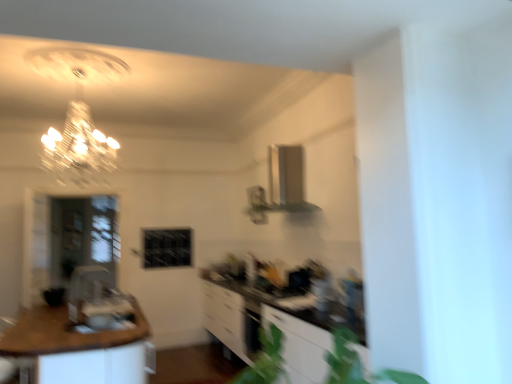
What do you see at coordinates (265, 327) in the screenshot? I see `white glossy cabinetry at center` at bounding box center [265, 327].

In order to face brown wood countertop at lower left, should I rotate leftwards or rightwards?

You should rotate left by 22.401 degrees.

Identify the location of white glossy cabinetry at center. The height and width of the screenshot is (384, 512). (265, 327).

Is brown wood countertop at lower left far away from transparent glass door at left?

Yes, brown wood countertop at lower left is far from transparent glass door at left.

Is brown wood countertop at lower left to the left or to the right of transparent glass door at left in the image?

brown wood countertop at lower left is to the right of transparent glass door at left.

How different are the orientations of brown wood countertop at lower left and transparent glass door at left in degrees?

There is a 91-degree angle between the facing directions of brown wood countertop at lower left and transparent glass door at left.

Is brown wood countertop at lower left surrounding transparent glass door at left?

No.

This screenshot has width=512, height=384. I want to click on cabinetry below the brown wood countertop at lower left (from a real-world perspective), so click(x=265, y=327).

Which of these two, brown wood countertop at lower left or white glossy cabinetry at center, is wider?

Wider between the two is brown wood countertop at lower left.

Does brown wood countertop at lower left have a smaller size compared to white glossy cabinetry at center?

Indeed, brown wood countertop at lower left has a smaller size compared to white glossy cabinetry at center.

Can you confirm if brown wood countertop at lower left is positioned to the left of white glossy cabinetry at center?

Correct, you'll find brown wood countertop at lower left to the left of white glossy cabinetry at center.

Measure the distance between white glossy cabinetry at center and transparent glass door at left.

The distance of white glossy cabinetry at center from transparent glass door at left is 2.12 meters.

Which is behind, white glossy cabinetry at center or transparent glass door at left?

transparent glass door at left is more distant.

Considering the positions of points (240, 301) and (57, 260), is point (240, 301) farther from camera compared to point (57, 260)?

That is False.

Between white glossy cabinetry at center and transparent glass door at left, which one appears on the right side from the viewer's perspective?

white glossy cabinetry at center is more to the right.

Between transparent glass door at left and white glossy cabinetry at center, which one has smaller width?

With smaller width is transparent glass door at left.

Based on the photo, from a real-world perspective, which is physically above, transparent glass door at left or white glossy cabinetry at center?

From a 3D spatial view, transparent glass door at left is above.

From the image's perspective, does transparent glass door at left appear higher than white glossy cabinetry at center?

Yes, from the image's perspective, transparent glass door at left is over white glossy cabinetry at center.

This screenshot has height=384, width=512. What are the coordinates of `glass door that appears above the white glossy cabinetry at center (from the image's perspective)` in the screenshot? It's located at (84, 235).

Can you tell me how much transparent glass door at left and brown wood countertop at lower left differ in facing direction?

The angle between the facing direction of transparent glass door at left and the facing direction of brown wood countertop at lower left is 91 degrees.

Considering the relative sizes of transparent glass door at left and brown wood countertop at lower left in the image provided, is transparent glass door at left taller than brown wood countertop at lower left?

Yes, transparent glass door at left is taller than brown wood countertop at lower left.

The image size is (512, 384). What are the coordinates of `glass door lying above the brown wood countertop at lower left (from the image's perspective)` in the screenshot? It's located at (84, 235).

From a real-world perspective, is transparent glass door at left positioned above or below brown wood countertop at lower left?

In terms of real-world spatial position, transparent glass door at left is above brown wood countertop at lower left.

Is white glossy cabinetry at center taller or shorter than brown wood countertop at lower left?

Considering their sizes, white glossy cabinetry at center has more height than brown wood countertop at lower left.

From a real-world perspective, is white glossy cabinetry at center located beneath brown wood countertop at lower left?

Yes.

From the image's perspective, does white glossy cabinetry at center appear higher than brown wood countertop at lower left?

Actually, white glossy cabinetry at center appears below brown wood countertop at lower left in the image.

Considering the relative sizes of white glossy cabinetry at center and brown wood countertop at lower left in the image provided, is white glossy cabinetry at center wider than brown wood countertop at lower left?

Incorrect, the width of white glossy cabinetry at center does not surpass that of brown wood countertop at lower left.

Find the location of a particular element. countertop on the right of transparent glass door at left is located at coordinates (65, 333).

Identify the location of cabinetry below the brown wood countertop at lower left (from the image's perspective). (265, 327).

From the image, which object appears to be nearer to brown wood countertop at lower left, transparent glass door at left or white glossy cabinetry at center?

white glossy cabinetry at center lies closer to brown wood countertop at lower left than the other object.

Considering their positions, is transparent glass door at left positioned further to white glossy cabinetry at center than brown wood countertop at lower left?

Among the two, transparent glass door at left is located further to white glossy cabinetry at center.

Considering their positions, is brown wood countertop at lower left positioned closer to white glossy cabinetry at center than transparent glass door at left?

The object closer to white glossy cabinetry at center is brown wood countertop at lower left.

Which object lies nearer to the anchor point transparent glass door at left, brown wood countertop at lower left or white glossy cabinetry at center?

white glossy cabinetry at center lies closer to transparent glass door at left than the other object.

When comparing their distances from brown wood countertop at lower left, does white glossy cabinetry at center or transparent glass door at left seem closer?

white glossy cabinetry at center is closer to brown wood countertop at lower left.

Considering their positions, is white glossy cabinetry at center positioned closer to transparent glass door at left than brown wood countertop at lower left?

white glossy cabinetry at center is positioned closer to the anchor transparent glass door at left.

This screenshot has height=384, width=512. Find the location of `cabinetry positioned between brown wood countertop at lower left and transparent glass door at left from near to far`. cabinetry positioned between brown wood countertop at lower left and transparent glass door at left from near to far is located at coordinates (265, 327).